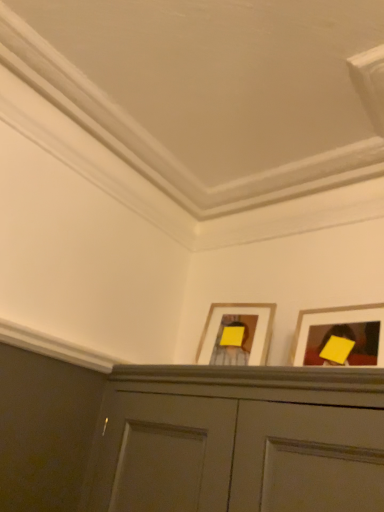
Question: Would you say yellow matte picture frame at upper center, which is the 2th picture frame from front to back, is to the left or to the right of yellow matte picture frame at upper right, placed as the 2th picture frame when sorted from left to right, in the picture?

Choices:
 (A) left
 (B) right

Answer: (A)

Question: Do you think yellow matte picture frame at upper center, the 1th picture frame viewed from the back, is within yellow matte picture frame at upper right, the 1th picture frame viewed from the front, or outside of it?

Choices:
 (A) inside
 (B) outside

Answer: (B)

Question: From a real-world perspective, is yellow matte picture frame at upper center, the 1th picture frame viewed from the back, physically located above or below yellow matte picture frame at upper right, placed as the 2th picture frame when sorted from left to right?

Choices:
 (A) below
 (B) above

Answer: (B)

Question: Choose the correct answer: Is yellow matte picture frame at upper right, which is the second picture frame in back-to-front order, inside yellow matte picture frame at upper center, which is the 2th picture frame from front to back, or outside it?

Choices:
 (A) outside
 (B) inside

Answer: (A)

Question: Visually, is yellow matte picture frame at upper right, arranged as the 1th picture frame when viewed from the right, positioned to the left or to the right of yellow matte picture frame at upper center, the second picture frame in the right-to-left sequence?

Choices:
 (A) left
 (B) right

Answer: (B)

Question: From the image's perspective, relative to yellow matte picture frame at upper center, which is the 2th picture frame from front to back, is yellow matte picture frame at upper right, placed as the 2th picture frame when sorted from left to right, above or below?

Choices:
 (A) below
 (B) above

Answer: (B)

Question: Considering the positions of yellow matte picture frame at upper right, placed as the 2th picture frame when sorted from left to right, and yellow matte picture frame at upper center, the 1th picture frame viewed from the back, in the image, is yellow matte picture frame at upper right, placed as the 2th picture frame when sorted from left to right, wider or thinner than yellow matte picture frame at upper center, the 1th picture frame viewed from the back,?

Choices:
 (A) wide
 (B) thin

Answer: (B)